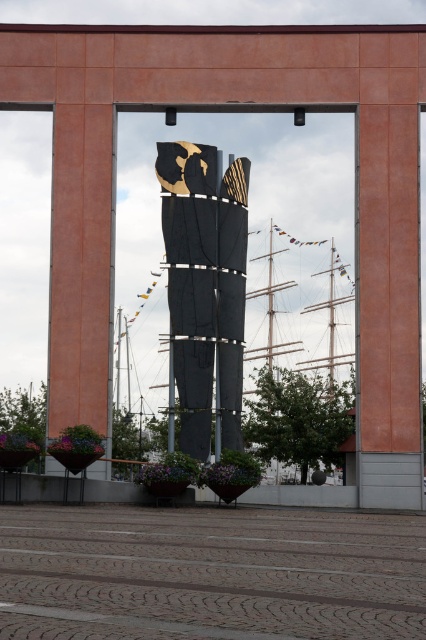
Can you confirm if black textured fabric at center is thinner than matte orange pillar at center?

No.

Between black textured fabric at center and matte orange pillar at center, which one is positioned lower?

matte orange pillar at center

Which is in front, point (207, 420) or point (108, 220)?

Point (108, 220) is more forward.

I want to click on black textured fabric at center, so click(x=204, y=285).